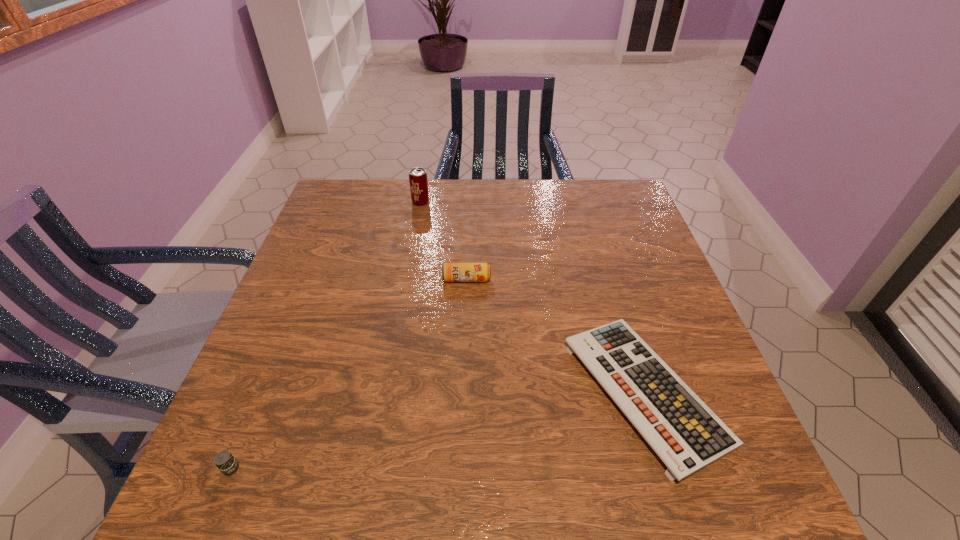
Locate an element on the screen. This screenshot has width=960, height=540. vacant region located on the right of the leftmost beer can is located at coordinates (303, 468).

This screenshot has width=960, height=540. In order to click on vacant region located 0.370m on the left of the rightmost object in this screenshot , I will do `click(384, 392)`.

Locate an element on the screen. The image size is (960, 540). object located in the far edge section of the desktop is located at coordinates (418, 181).

Identify the location of beer can that is at the near edge. (227, 464).

The image size is (960, 540). In order to click on computer keyboard positioned at the near edge in this screenshot , I will do `click(685, 433)`.

Find the location of a particular element. object that is at the left edge is located at coordinates (227, 464).

This screenshot has height=540, width=960. Identify the location of object present at the right edge. (685, 433).

Locate an element on the screen. The height and width of the screenshot is (540, 960). object that is positioned at the near left corner is located at coordinates (227, 464).

Identify the location of object located at the near right corner. (685, 433).

The width and height of the screenshot is (960, 540). In the image, there is a desktop. What are the coordinates of `vacant space at the far edge` in the screenshot? It's located at (490, 185).